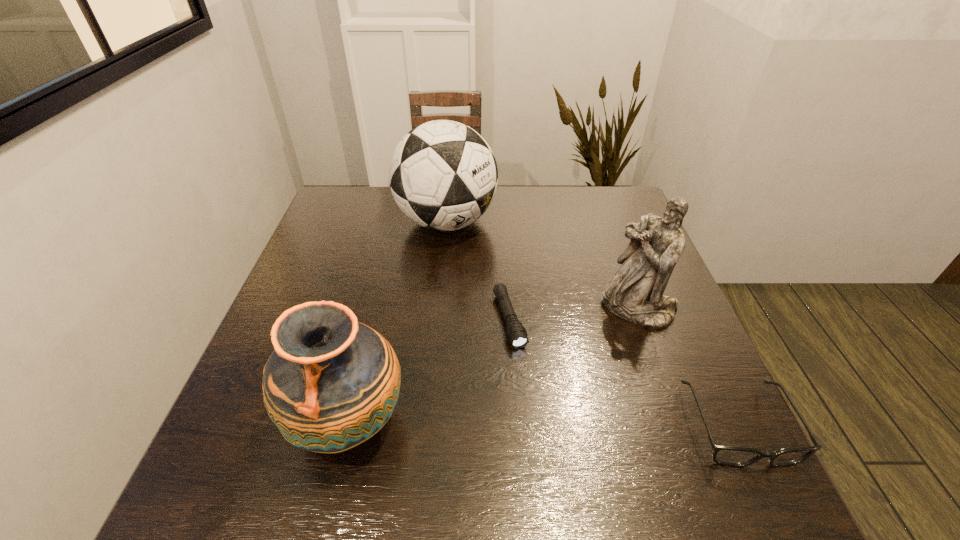
Image resolution: width=960 pixels, height=540 pixels. I want to click on free space between the second shortest object and the farthest object, so click(592, 323).

Locate an element on the screen. The image size is (960, 540). free spot between the spectacles and the pottery is located at coordinates (543, 423).

Locate an element on the screen. vacant area that lies between the spectacles and the pottery is located at coordinates (543, 423).

Identify the location of blank region between the figurine and the shortest object. The height and width of the screenshot is (540, 960). (573, 314).

I want to click on blank region between the fourth tallest object and the pottery, so click(x=543, y=423).

Where is `vacant space that's between the figurine and the pottery`? vacant space that's between the figurine and the pottery is located at coordinates (493, 364).

Find the location of a particular element. The height and width of the screenshot is (540, 960). empty space that is in between the shortest object and the figurine is located at coordinates (573, 314).

Identify the location of free space between the pottery and the figurine. This screenshot has height=540, width=960. click(x=493, y=364).

At what (x,y) coordinates should I click in order to perform the action: click on object identified as the closest to the pottery. Please return your answer as a coordinate pair (x, y). The width and height of the screenshot is (960, 540). Looking at the image, I should click on (517, 335).

Identify which object is the third closest to the farthest object. Please provide its 2D coordinates. Your answer should be formatted as a tuple, i.e. [(x, y)], where the tuple contains the x and y coordinates of a point satisfying the conditions above.

[(332, 383)]